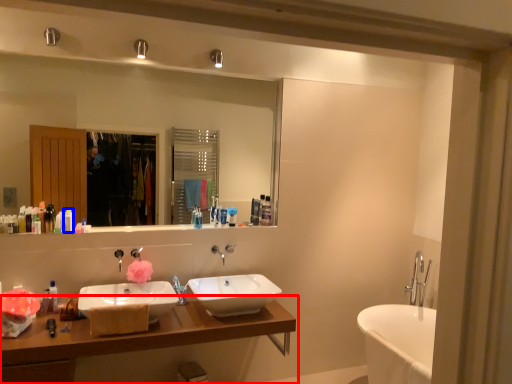
Question: Which of the following is the farthest to the observer, bathroom cabinet (highlighted by a red box) or toiletry (highlighted by a blue box)?

Choices:
 (A) bathroom cabinet
 (B) toiletry

Answer: (B)